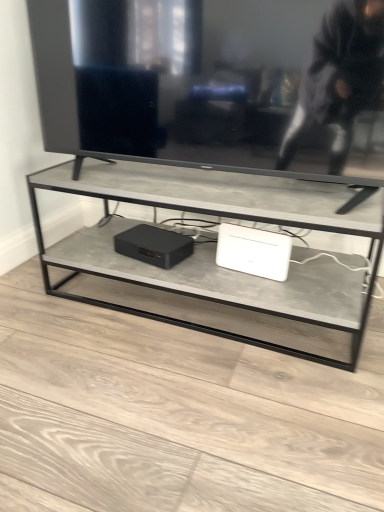
Identify the location of matte black device at center, the first computer positioned from the left. Image resolution: width=384 pixels, height=512 pixels. [154, 245].

Describe the element at coordinates (154, 245) in the screenshot. This screenshot has height=512, width=384. I see `matte black device at center, the first computer positioned from the left` at that location.

This screenshot has width=384, height=512. What do you see at coordinates (254, 251) in the screenshot? I see `white plastic router at center, which ranks as the first computer in right-to-left order` at bounding box center [254, 251].

The width and height of the screenshot is (384, 512). Find the location of `white plastic router at center, which appears as the second computer when viewed from the left`. white plastic router at center, which appears as the second computer when viewed from the left is located at coordinates pos(254,251).

Identify the location of matte black device at center, the first computer positioned from the left. This screenshot has height=512, width=384. coord(154,245).

Looking at this image, is matte black device at center, which is counted as the 2th computer, starting from the right, at the left side of white plastic router at center, which ranks as the first computer in right-to-left order?

Indeed, matte black device at center, which is counted as the 2th computer, starting from the right, is positioned on the left side of white plastic router at center, which ranks as the first computer in right-to-left order.

Is the position of matte black device at center, which is counted as the 2th computer, starting from the right, less distant than that of white plastic router at center, which ranks as the first computer in right-to-left order?

No, matte black device at center, which is counted as the 2th computer, starting from the right, is further to the viewer.

Does point (127, 233) come farther from viewer compared to point (270, 234)?

Yes, point (127, 233) is farther from viewer.

From the image's perspective, is matte black device at center, the first computer positioned from the left, on top of white plastic router at center, which appears as the second computer when viewed from the left?

Correct, matte black device at center, the first computer positioned from the left, appears higher than white plastic router at center, which appears as the second computer when viewed from the left, in the image.

Looking at this image, from a real-world perspective, does matte black device at center, which is counted as the 2th computer, starting from the right, sit lower than white plastic router at center, which ranks as the first computer in right-to-left order?

Yes.

Is matte black device at center, the first computer positioned from the left, thinner than white plastic router at center, which ranks as the first computer in right-to-left order?

Incorrect, the width of matte black device at center, the first computer positioned from the left, is not less than that of white plastic router at center, which ranks as the first computer in right-to-left order.

Is matte black device at center, the first computer positioned from the left, taller than white plastic router at center, which ranks as the first computer in right-to-left order?

No, matte black device at center, the first computer positioned from the left, is not taller than white plastic router at center, which ranks as the first computer in right-to-left order.

Considering the sizes of objects matte black device at center, the first computer positioned from the left, and white plastic router at center, which appears as the second computer when viewed from the left, in the image provided, who is bigger, matte black device at center, the first computer positioned from the left, or white plastic router at center, which appears as the second computer when viewed from the left,?

matte black device at center, the first computer positioned from the left.

Is matte black device at center, which is counted as the 2th computer, starting from the right, surrounding white plastic router at center, which ranks as the first computer in right-to-left order?

That's incorrect, white plastic router at center, which ranks as the first computer in right-to-left order, is not inside matte black device at center, which is counted as the 2th computer, starting from the right.

Would you say matte black device at center, the first computer positioned from the left, is a long distance from white plastic router at center, which appears as the second computer when viewed from the left?

They are positioned close to each other.

Is matte black device at center, which is counted as the 2th computer, starting from the right, oriented towards white plastic router at center, which ranks as the first computer in right-to-left order?

No.

Identify the location of computer below the white plastic router at center, which ranks as the first computer in right-to-left order (from a real-world perspective). (154, 245).

Which object is positioned more to the left, white plastic router at center, which ranks as the first computer in right-to-left order, or matte black device at center, the first computer positioned from the left?

matte black device at center, the first computer positioned from the left, is more to the left.

Which is in front, white plastic router at center, which ranks as the first computer in right-to-left order, or matte black device at center, the first computer positioned from the left?

white plastic router at center, which ranks as the first computer in right-to-left order.

Between point (268, 240) and point (178, 259), which one is positioned behind?

The point (178, 259) is behind.

From the image's perspective, is white plastic router at center, which appears as the second computer when viewed from the left, below matte black device at center, which is counted as the 2th computer, starting from the right?

Yes, from the image's perspective, white plastic router at center, which appears as the second computer when viewed from the left, is below matte black device at center, which is counted as the 2th computer, starting from the right.

In the scene shown: From a real-world perspective, is white plastic router at center, which ranks as the first computer in right-to-left order, beneath matte black device at center, the first computer positioned from the left?

No.

Does white plastic router at center, which ranks as the first computer in right-to-left order, have a greater width compared to matte black device at center, the first computer positioned from the left?

No, white plastic router at center, which ranks as the first computer in right-to-left order, is not wider than matte black device at center, the first computer positioned from the left.

Who is taller, white plastic router at center, which appears as the second computer when viewed from the left, or matte black device at center, which is counted as the 2th computer, starting from the right?

white plastic router at center, which appears as the second computer when viewed from the left.

From the picture: Who is smaller, white plastic router at center, which ranks as the first computer in right-to-left order, or matte black device at center, which is counted as the 2th computer, starting from the right?

white plastic router at center, which ranks as the first computer in right-to-left order.

Choose the correct answer: Is white plastic router at center, which appears as the second computer when viewed from the left, inside matte black device at center, which is counted as the 2th computer, starting from the right, or outside it?

white plastic router at center, which appears as the second computer when viewed from the left, is outside matte black device at center, which is counted as the 2th computer, starting from the right.

Is white plastic router at center, which ranks as the first computer in right-to-left order, not near matte black device at center, which is counted as the 2th computer, starting from the right?

No.

Is white plastic router at center, which appears as the second computer when viewed from the left, oriented towards matte black device at center, which is counted as the 2th computer, starting from the right?

No.

Identify the location of computer in front of the matte black device at center, which is counted as the 2th computer, starting from the right. 254,251.

This screenshot has height=512, width=384. In order to click on computer located on the left of white plastic router at center, which ranks as the first computer in right-to-left order in this screenshot , I will do `click(154, 245)`.

The image size is (384, 512). Find the location of `computer on the right of matte black device at center, which is counted as the 2th computer, starting from the right`. computer on the right of matte black device at center, which is counted as the 2th computer, starting from the right is located at coordinates (254, 251).